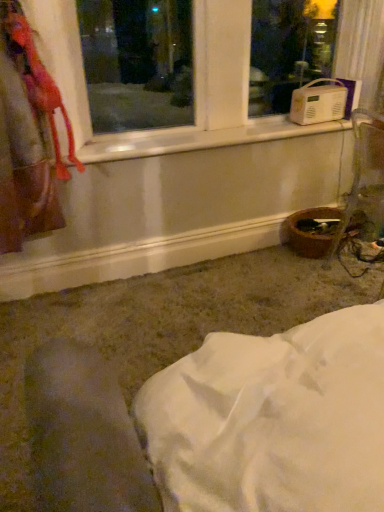
Question: From the image's perspective, is velvet-like pink scarf at upper left under white plastic radio at upper right?

Choices:
 (A) no
 (B) yes

Answer: (B)

Question: Considering the relative sizes of velvet-like pink scarf at upper left and white plastic radio at upper right in the image provided, is velvet-like pink scarf at upper left thinner than white plastic radio at upper right?

Choices:
 (A) yes
 (B) no

Answer: (A)

Question: From a real-world perspective, is velvet-like pink scarf at upper left over white plastic radio at upper right?

Choices:
 (A) no
 (B) yes

Answer: (A)

Question: Considering the relative sizes of velvet-like pink scarf at upper left and white plastic radio at upper right in the image provided, is velvet-like pink scarf at upper left wider than white plastic radio at upper right?

Choices:
 (A) no
 (B) yes

Answer: (A)

Question: Is velvet-like pink scarf at upper left surrounding white plastic radio at upper right?

Choices:
 (A) no
 (B) yes

Answer: (A)

Question: Is velvet-like pink scarf at upper left located outside white plastic radio at upper right?

Choices:
 (A) no
 (B) yes

Answer: (B)

Question: Does white plastic radio at upper right turn towards velvet-like pink scarf at upper left?

Choices:
 (A) yes
 (B) no

Answer: (A)

Question: Can you confirm if white plastic radio at upper right is thinner than velvet-like pink scarf at upper left?

Choices:
 (A) no
 (B) yes

Answer: (A)

Question: Can you confirm if white plastic radio at upper right is smaller than velvet-like pink scarf at upper left?

Choices:
 (A) yes
 (B) no

Answer: (B)

Question: From a real-world perspective, is white plastic radio at upper right located higher than velvet-like pink scarf at upper left?

Choices:
 (A) no
 (B) yes

Answer: (B)

Question: Considering the relative sizes of white plastic radio at upper right and velvet-like pink scarf at upper left in the image provided, is white plastic radio at upper right wider than velvet-like pink scarf at upper left?

Choices:
 (A) no
 (B) yes

Answer: (B)

Question: Does white plastic radio at upper right have a larger size compared to velvet-like pink scarf at upper left?

Choices:
 (A) no
 (B) yes

Answer: (B)

Question: Does point (21, 22) appear closer or farther from the camera than point (185, 32)?

Choices:
 (A) closer
 (B) farther

Answer: (A)